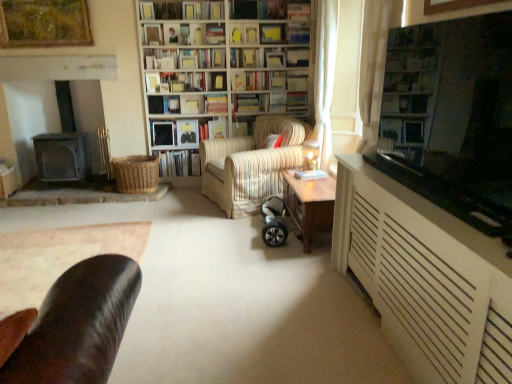
This screenshot has height=384, width=512. Describe the element at coordinates (269, 57) in the screenshot. I see `hardcover book at center, which is the 4th book in top-to-bottom order` at that location.

Locate an element on the screen. The width and height of the screenshot is (512, 384). hardcover book at upper center, the 8th book ordered from the bottom is located at coordinates (184, 58).

Measure the distance between point (180, 128) and camera.

A distance of 15.88 feet exists between point (180, 128) and camera.

What do you see at coordinates (216, 104) in the screenshot? The width and height of the screenshot is (512, 384). I see `hardcover book at center, marked as the eighth book in a top-to-bottom arrangement` at bounding box center [216, 104].

What is the approximate height of hardcover books at center, which appears as the sixth book when ordered from the bottom?

The height of hardcover books at center, which appears as the sixth book when ordered from the bottom, is 9.00 inches.

This screenshot has height=384, width=512. Identify the location of silver metallic hoverboard at center. (274, 222).

I want to click on hardcover book at center, placed as the ninth book when sorted from bottom to top, so click(269, 57).

From the image's perspective, between white textured cabinet at right and hardcover book at upper center, which is the 2th book in top-to-bottom order, which one is located above?

From the image's view, hardcover book at upper center, which is the 2th book in top-to-bottom order, is above.

Does white textured cabinet at right have a greater width compared to hardcover book at upper center, which is the 2th book in top-to-bottom order?

Indeed, white textured cabinet at right has a greater width compared to hardcover book at upper center, which is the 2th book in top-to-bottom order.

Which is closer to the camera, (353, 170) or (184, 12)?

Point (353, 170) is closer to the camera than point (184, 12).

Between white textured cabinet at right and hardcover book at upper center, positioned as the 11th book in bottom-to-top order, which one has larger size?

With larger size is white textured cabinet at right.

Considering the relative sizes of silver metallic hoverboard at center and dark wood fireplace at left in the image provided, is silver metallic hoverboard at center taller than dark wood fireplace at left?

In fact, silver metallic hoverboard at center may be shorter than dark wood fireplace at left.

From the image's perspective, which is below, silver metallic hoverboard at center or dark wood fireplace at left?

silver metallic hoverboard at center appears lower in the image.

Identify the location of baby carriage that appears on the right of dark wood fireplace at left. (274, 222).

In the scene shown: Which of these two, silver metallic hoverboard at center or dark wood fireplace at left, is smaller?

silver metallic hoverboard at center.

At what (x,y) coordinates should I click in order to perform the action: click on book that is the 3rd object directly below the transparent glass window screen at upper right (from a real-world perspective). Please return your answer as a coordinate pair (x, y). This screenshot has height=384, width=512. Looking at the image, I should click on (216, 104).

Between hardcover book at center, positioned as the fifth book in bottom-to-top order, and transparent glass window screen at upper right, which one appears on the left side from the viewer's perspective?

hardcover book at center, positioned as the fifth book in bottom-to-top order.

Is hardcover book at center, positioned as the fifth book in bottom-to-top order, further to camera compared to transparent glass window screen at upper right?

Yes, hardcover book at center, positioned as the fifth book in bottom-to-top order, is behind transparent glass window screen at upper right.

Is silver metallic hoverboard at center in front of or behind hardcover book at center, marked as the eighth book in a top-to-bottom arrangement, in the image?

In the image, silver metallic hoverboard at center appears in front of hardcover book at center, marked as the eighth book in a top-to-bottom arrangement.

Between silver metallic hoverboard at center and hardcover book at center, positioned as the fifth book in bottom-to-top order, which one has larger size?

With larger size is silver metallic hoverboard at center.

I want to click on baby carriage in front of the hardcover book at center, positioned as the fifth book in bottom-to-top order, so click(274, 222).

In the scene shown: In terms of height, does white textured cabinet at right look taller or shorter compared to hardcover book at center, which appears as the fourth book when ordered from the bottom?

Considering their sizes, white textured cabinet at right has more height than hardcover book at center, which appears as the fourth book when ordered from the bottom.

Based on their sizes in the image, would you say white textured cabinet at right is bigger or smaller than hardcover book at center, acting as the ninth book starting from the top?

Clearly, white textured cabinet at right is larger in size than hardcover book at center, acting as the ninth book starting from the top.

Considering the relative positions of white textured cabinet at right and hardcover book at center, acting as the ninth book starting from the top, in the image provided, is white textured cabinet at right to the right of hardcover book at center, acting as the ninth book starting from the top, from the viewer's perspective?

Correct, you'll find white textured cabinet at right to the right of hardcover book at center, acting as the ninth book starting from the top.

Is white textured cabinet at right wider or thinner than hardcover book at center, acting as the ninth book starting from the top?

In the image, white textured cabinet at right appears to be wider than hardcover book at center, acting as the ninth book starting from the top.

How many degrees apart are the facing directions of silver metallic hoverboard at center and hardcover book at center, which appears as the fourth book when ordered from the bottom?

There is a 90.3-degree angle between the facing directions of silver metallic hoverboard at center and hardcover book at center, which appears as the fourth book when ordered from the bottom.

Is silver metallic hoverboard at center facing away from hardcover book at center, which appears as the fourth book when ordered from the bottom?

No, hardcover book at center, which appears as the fourth book when ordered from the bottom, is not at the back of silver metallic hoverboard at center.

Measure the distance from silver metallic hoverboard at center to hardcover book at center, which appears as the fourth book when ordered from the bottom.

They are 5.09 feet apart.

From their relative heights in the image, would you say silver metallic hoverboard at center is taller or shorter than hardcover book at center, which appears as the fourth book when ordered from the bottom?

In the image, silver metallic hoverboard at center appears to be shorter than hardcover book at center, which appears as the fourth book when ordered from the bottom.

Considering the sizes of objects hardcover book at upper center, the 3th book in the top-to-bottom sequence, and hardcover book at upper center, which is the 2th book in top-to-bottom order, in the image provided, who is shorter, hardcover book at upper center, the 3th book in the top-to-bottom sequence, or hardcover book at upper center, which is the 2th book in top-to-bottom order,?

With less height is hardcover book at upper center, which is the 2th book in top-to-bottom order.

Do you think hardcover book at upper center, the 3th book in the top-to-bottom sequence, is within hardcover book at upper center, positioned as the 11th book in bottom-to-top order, or outside of it?

hardcover book at upper center, the 3th book in the top-to-bottom sequence, lies outside hardcover book at upper center, positioned as the 11th book in bottom-to-top order.

Is hardcover book at upper center, which ranks as the 10th book in bottom-to-top order, facing towards hardcover book at upper center, positioned as the 11th book in bottom-to-top order?

No, hardcover book at upper center, which ranks as the 10th book in bottom-to-top order, is not aimed at hardcover book at upper center, positioned as the 11th book in bottom-to-top order.

Image resolution: width=512 pixels, height=384 pixels. What are the coordinates of `the 6th book to the right when counting from the hardcover book at upper center, the 3th book in the top-to-bottom sequence` in the screenshot? It's located at (181, 10).

I want to click on cabinetry below the hardcover book at upper center, positioned as the 11th book in bottom-to-top order (from the image's perspective), so click(425, 278).

Find the location of `fireplace behind the silver metallic hoverboard at center`. fireplace behind the silver metallic hoverboard at center is located at coordinates (64, 144).

When comparing their distances from hardcover book at center, marked as the eighth book in a top-to-bottom arrangement, does white sheer curtain at upper right or striped fabric armchair at center seem closer?

The object closer to hardcover book at center, marked as the eighth book in a top-to-bottom arrangement, is striped fabric armchair at center.

From the image, which object appears to be farther from hardcover book at upper center, which is the 2th book in top-to-bottom order, white sheer curtain at upper right or wooden bookshelf at center?

The object further to hardcover book at upper center, which is the 2th book in top-to-bottom order, is white sheer curtain at upper right.

Considering their positions, is hardcover book at center, placed as the ninth book when sorted from bottom to top, positioned further to striped fabric armchair at center than hardcover book at upper center, which ranks as the 10th book in bottom-to-top order?

hardcover book at upper center, which ranks as the 10th book in bottom-to-top order, is further to striped fabric armchair at center.

Looking at the image, which one is located further to hardcover book at center, positioned as the fifth book in bottom-to-top order, gold textured picture frame at upper left or hardcover book at center, acting as the ninth book starting from the top?

gold textured picture frame at upper left is positioned further to the anchor hardcover book at center, positioned as the fifth book in bottom-to-top order.

When comparing their distances from hardcover book at center, marked as the eighth book in a top-to-bottom arrangement, does white sheer curtain at upper right or gold textured picture frame at upper left seem closer?

white sheer curtain at upper right is positioned closer to the anchor hardcover book at center, marked as the eighth book in a top-to-bottom arrangement.

When comparing their distances from silver metallic hoverboard at center, does dark wood fireplace at left or hardcover book at center, which is the 4th book in top-to-bottom order, seem closer?

The object closer to silver metallic hoverboard at center is hardcover book at center, which is the 4th book in top-to-bottom order.

Looking at the image, which one is located further to dark wood fireplace at left, hardcover book at upper center, the twelfth book from the bottom, or silver metallic hoverboard at center?

silver metallic hoverboard at center is further to dark wood fireplace at left.

Considering their positions, is wooden bookshelf at center positioned closer to hardcover book at center, which appears as the fourth book when ordered from the bottom, than hardcover book at upper center, which is the fifth book in top-to-bottom order?

wooden bookshelf at center.

Find the location of a particular element. Image resolution: width=512 pixels, height=384 pixels. table between white textured cabinet at right and white sheer curtain at upper right in the front-back direction is located at coordinates (309, 205).

At what (x,y) coordinates should I click in order to perform the action: click on chair positioned between transparent glass window screen at upper right and hardcover book at center, marked as the first book in a bottom-to-top arrangement, from near to far. Please return your answer as a coordinate pair (x, y). Image resolution: width=512 pixels, height=384 pixels. Looking at the image, I should click on (251, 164).

You are a GUI agent. You are given a task and a screenshot of the screen. Output one action in this format:
    pyautogui.click(x=<x>, y=<y>)
    Task: Click on the bookcase between gold textured picture frame at upper left and hardcover book at center, which is the 4th book in top-to-bottom order
    The height and width of the screenshot is (384, 512).
    Given the screenshot: What is the action you would take?
    pyautogui.click(x=225, y=63)

Locate an element on the screen. This screenshot has width=512, height=384. picture frame situated between dark wood fireplace at left and hardcover book at upper center, which is the fifth book in top-to-bottom order, from left to right is located at coordinates (44, 23).